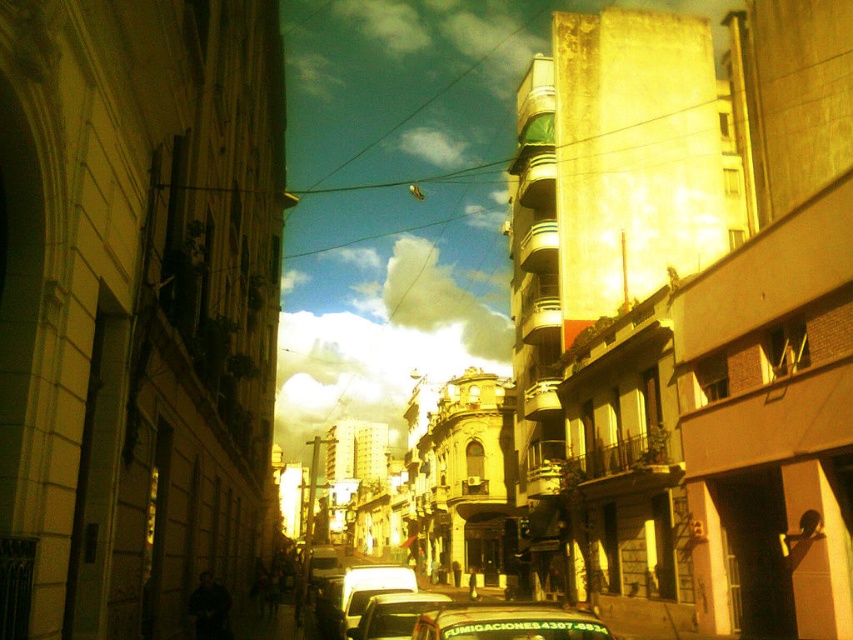
Question: Which object is farther from the camera taking this photo?

Choices:
 (A) metallic silver car at center
 (B) metallic green taxi at center
 (C) shiny silver car at center

Answer: (C)

Question: Is metallic green taxi at center closer to the viewer compared to shiny silver car at center?

Choices:
 (A) no
 (B) yes

Answer: (B)

Question: Which of the following is the farthest from the observer?

Choices:
 (A) metallic green taxi at center
 (B) metallic silver car at center

Answer: (B)

Question: Can you confirm if metallic green taxi at center is bigger than metallic silver car at center?

Choices:
 (A) no
 (B) yes

Answer: (A)

Question: Which of the following is the closest to the observer?

Choices:
 (A) metallic silver car at center
 (B) shiny silver car at center

Answer: (A)

Question: Can you confirm if metallic green taxi at center is wider than metallic silver car at center?

Choices:
 (A) no
 (B) yes

Answer: (B)